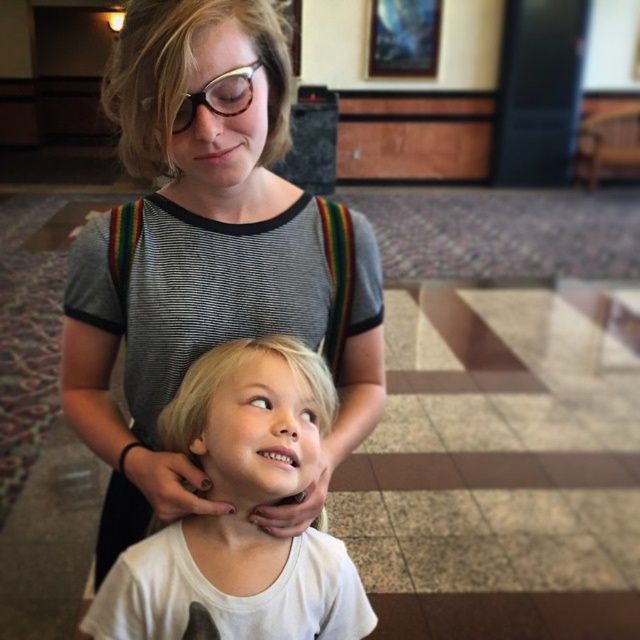
Based on the photo, is matte gray shirt at center in front of white matte shirt at center?

That is True.

Who is higher up, matte gray shirt at center or white matte shirt at center?

matte gray shirt at center

Who is more distant from viewer, [184,493] or [189,570]?

The point [189,570] is more distant.

Where is `matte gray shirt at center`? The height and width of the screenshot is (640, 640). matte gray shirt at center is located at coordinates (205, 262).

What do you see at coordinates (241, 513) in the screenshot? I see `white matte shirt at center` at bounding box center [241, 513].

Which is in front, point (202, 592) or point (204, 84)?

Point (204, 84) is in front.

Locate an element on the screen. This screenshot has height=640, width=640. white matte shirt at center is located at coordinates (241, 513).

Who is positioned more to the right, matte gray shirt at center or matte black glasses at upper center?

matte black glasses at upper center is more to the right.

Who is higher up, matte gray shirt at center or matte black glasses at upper center?

matte black glasses at upper center is higher up.

Identify the location of matte gray shirt at center. The image size is (640, 640). (205, 262).

Locate an element on the screen. This screenshot has width=640, height=640. matte gray shirt at center is located at coordinates (205, 262).